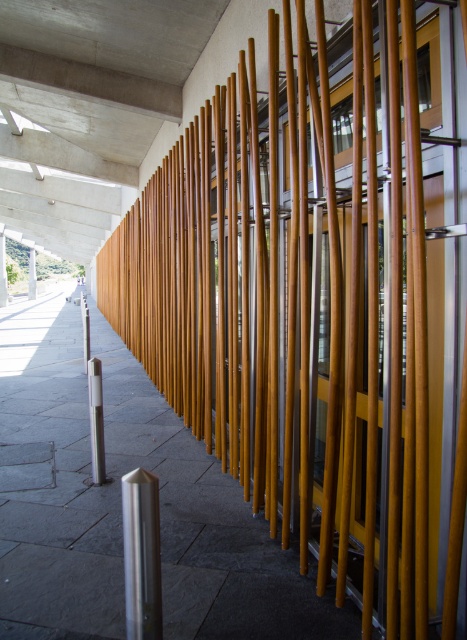
You are a delivery person with a cart that is 100 feet long. You need to move from one end of the slate gray pavement at center to the other end near the smooth concrete pillar at center. Can your cart fit within the space between them?

Answer: The slate gray pavement at center and smooth concrete pillar at center are 99.06 feet apart. Since the cart is 100 feet long, it cannot fit within the space between them as the distance is slightly shorter than the cart.

You are a delivery person trying to park your 2.5 meter wide delivery truck between the slate gray pavement at center and the smooth concrete pillar at center. Is there enough space for the truck to fit between them?

The slate gray pavement at center is positioned under the smooth concrete pillar at center, meaning they are vertically aligned rather than horizontally separated. There is no horizontal space between them for the truck to fit.